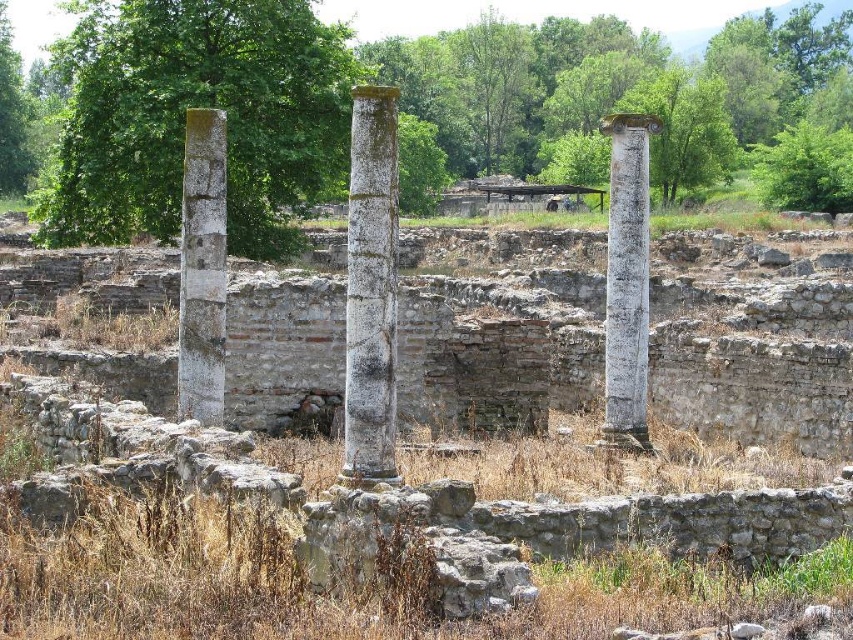
You are an archaeologist examining the ruins. You need to determine which column is more massive between the white marble column at center and the gray stone column at left. Based on the scene, which one is larger?

The white marble column at center is larger in size than the gray stone column at left, so the white marble column at center is more massive.

You are an archaeologist examining the ruins. You notice two columns at the center of the scene. Which column is located above the other? The green mossy column at center or the white marble column at center?

The green mossy column at center is positioned over the white marble column at center.

In the scene shown: You are an archaeologist examining the ruins of an ancient structure. You notice a point marked at coordinates (370, 289). What significant feature does this point indicate?

The point at coordinates (370, 289) marks the location of the white marble column at center.